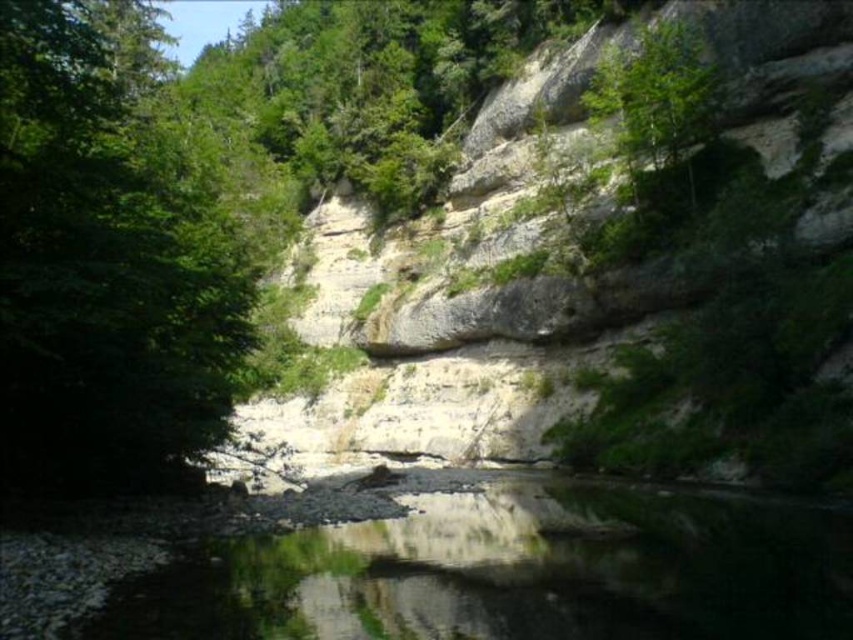
Question: Which object is farther from the camera taking this photo?

Choices:
 (A) green reflective water at center
 (B) green leafy tree at upper center

Answer: (B)

Question: Observing the image, what is the correct spatial positioning of green reflective water at center in reference to green leafy tree at upper center?

Choices:
 (A) above
 (B) below

Answer: (B)

Question: Which point is closer to the camera?

Choices:
 (A) green leafy tree at upper center
 (B) green reflective water at center

Answer: (B)

Question: Among these objects, which one is nearest to the camera?

Choices:
 (A) green reflective water at center
 (B) green leafy tree at upper center

Answer: (A)

Question: Does green reflective water at center appear over green leafy tree at upper center?

Choices:
 (A) yes
 (B) no

Answer: (B)

Question: Where is green reflective water at center located in relation to green leafy tree at upper center in the image?

Choices:
 (A) above
 (B) below

Answer: (B)